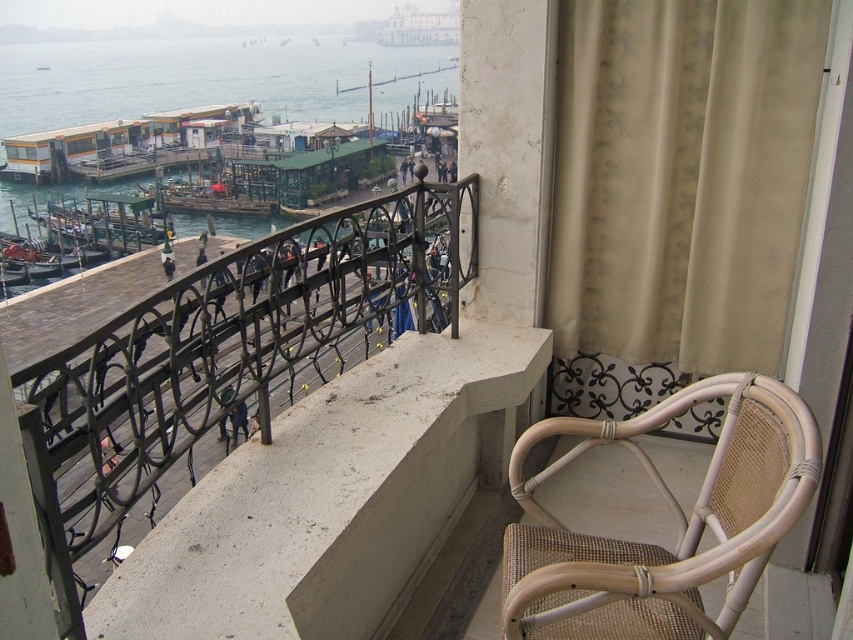
What object is located at the coordinates point (x=219, y=360) on the balcony?

The point (x=219, y=360) indicates the location of the black wrought iron railing at center.

You are standing on the balcony and want to take a photo of the waterfront through the clear glass window at upper center. However, the black wrought iron railing at center is blocking your view. Can you move closer to the window to avoid the railing?

The black wrought iron railing at center is closer to the viewer than the clear glass window at upper center, so moving closer to the window would bring you closer to the railing, making it more obstructive. To avoid the railing, you should move further away from the window instead.

You are standing on the balcony and want to move from the green wooden dock at center to the light beige woven chair at lower right. Which direction should you move to reach the chair?

To reach the light beige woven chair at lower right from the green wooden dock at center, you should move to the right since the light beige woven chair at lower right is located to the right of the green wooden dock at center.